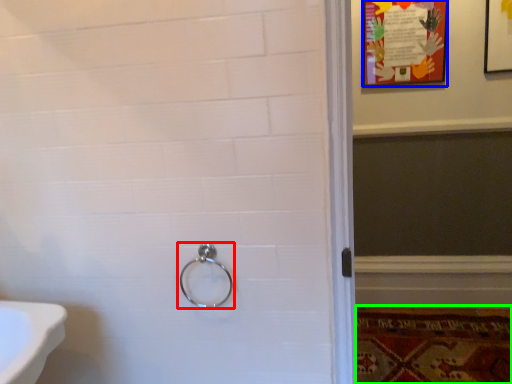
Question: Which is nearer to the door handle (highlighted by a red box)? poster page (highlighted by a blue box) or mat (highlighted by a green box).

Choices:
 (A) poster page
 (B) mat

Answer: (B)